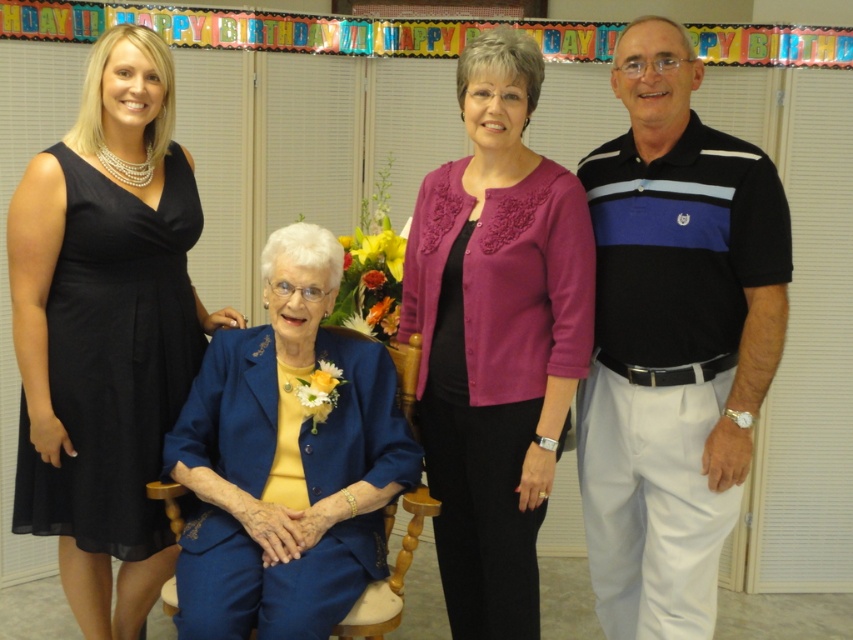
Question: Is black striped polo shirt at right positioned at the back of black chiffon dress at left?

Choices:
 (A) no
 (B) yes

Answer: (A)

Question: Which point is farther from the camera taking this photo?

Choices:
 (A) (100, 58)
 (B) (479, 320)
 (C) (593, 163)
 (D) (363, 413)

Answer: (C)

Question: From the image, what is the correct spatial relationship of purple embroidered cardigan at center in relation to blue satin suit at center?

Choices:
 (A) above
 (B) below

Answer: (A)

Question: Which object is the closest to the blue satin suit at center?

Choices:
 (A) purple embroidered cardigan at center
 (B) black chiffon dress at left
 (C) black striped polo shirt at right

Answer: (B)

Question: Can you confirm if black chiffon dress at left is smaller than blue satin suit at center?

Choices:
 (A) no
 (B) yes

Answer: (A)

Question: Which of these objects is positioned farthest from the blue satin suit at center?

Choices:
 (A) purple embroidered cardigan at center
 (B) black chiffon dress at left

Answer: (A)